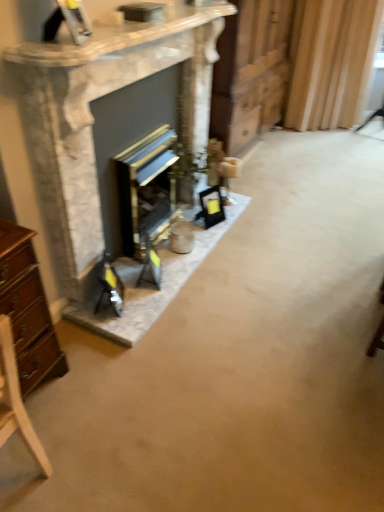
The width and height of the screenshot is (384, 512). Describe the element at coordinates (250, 71) in the screenshot. I see `wooden at center` at that location.

This screenshot has height=512, width=384. Describe the element at coordinates (146, 189) in the screenshot. I see `gold metallic wood burning stove at center` at that location.

Describe the element at coordinates (16, 400) in the screenshot. I see `light wood chair at lower left` at that location.

Identify the location of marble fireplace at center. Image resolution: width=384 pixels, height=512 pixels. (93, 118).

In order to face matte black picture frame at center, should I rotate leftwards or rightwards?

Turn right approximately 2.700 degrees to face it.

I want to click on wooden at center, so click(x=250, y=71).

Consider the image. From a real-world perspective, does wooden at center stand above gold metallic wood burning stove at center?

Indeed, from a real-world perspective, wooden at center stands above gold metallic wood burning stove at center.

Looking at their sizes, would you say wooden at center is wider or thinner than gold metallic wood burning stove at center?

Considering their sizes, wooden at center looks broader than gold metallic wood burning stove at center.

Based on the photo, does wooden at center touch gold metallic wood burning stove at center?

No, wooden at center is not next to gold metallic wood burning stove at center.

Which object is more forward, wooden at center or gold metallic wood burning stove at center?

Positioned in front is gold metallic wood burning stove at center.

From the image's perspective, which is above, marble fireplace at center or matte black picture frame at center?

marble fireplace at center.

Does point (47, 71) appear closer or farther from the camera than point (212, 208)?

Point (47, 71).

Considering the relative sizes of marble fireplace at center and matte black picture frame at center in the image provided, is marble fireplace at center bigger than matte black picture frame at center?

Correct, marble fireplace at center is larger in size than matte black picture frame at center.

Is light wood chair at lower left touching matte black picture frame at center?

No, light wood chair at lower left is not making contact with matte black picture frame at center.

How far apart are light wood chair at lower left and matte black picture frame at center?

light wood chair at lower left is 1.64 meters from matte black picture frame at center.

From a real-world perspective, which is physically above, light wood chair at lower left or matte black picture frame at center?

From a 3D spatial view, light wood chair at lower left is above.

Image resolution: width=384 pixels, height=512 pixels. In order to click on picture frame behind the light wood chair at lower left in this screenshot , I will do `click(211, 206)`.

From a real-world perspective, which object stands above the other?

wooden at center.

Is wooden at center smaller than marble fireplace at center?

Actually, wooden at center might be larger than marble fireplace at center.

Which is more to the right, wooden at center or marble fireplace at center?

wooden at center.

Is marble fireplace at center directly adjacent to light wood chair at lower left?

No, marble fireplace at center is not with light wood chair at lower left.

Considering the positions of objects marble fireplace at center and light wood chair at lower left in the image provided, who is in front, marble fireplace at center or light wood chair at lower left?

light wood chair at lower left is more forward.

Which of these two, marble fireplace at center or light wood chair at lower left, is thinner?

Thinner between the two is marble fireplace at center.

From the image's perspective, is marble fireplace at center located above or below light wood chair at lower left?

Based on their image positions, marble fireplace at center is located above light wood chair at lower left.

Is point (246, 76) closer to camera compared to point (335, 110)?

Yes, it is.

You are a GUI agent. You are given a task and a screenshot of the screen. Output one action in this format:
    pyautogui.click(x=<x>, y=<y>)
    Task: Click on the dresser that appears on the left of wooden curtain at right
    The height and width of the screenshot is (512, 384).
    Given the screenshot: What is the action you would take?
    pyautogui.click(x=250, y=71)

Considering the relative positions of wooden at center and wooden curtain at right in the image provided, is wooden at center to the right of wooden curtain at right from the viewer's perspective?

No, wooden at center is not to the right of wooden curtain at right.

Which is correct: matte black picture frame at center is inside light wood chair at lower left, or outside of it?

The correct answer is: outside.

Considering the sizes of objects matte black picture frame at center and light wood chair at lower left in the image provided, who is taller, matte black picture frame at center or light wood chair at lower left?

light wood chair at lower left is taller.

Considering the relative sizes of matte black picture frame at center and light wood chair at lower left in the image provided, is matte black picture frame at center thinner than light wood chair at lower left?

Yes, matte black picture frame at center is thinner than light wood chair at lower left.

Locate an element on the screen. Image resolution: width=384 pixels, height=512 pixels. picture frame behind the light wood chair at lower left is located at coordinates (211, 206).

Where is `wood burning stove that appears below the wooden at center (from the image's perspective)`? The image size is (384, 512). wood burning stove that appears below the wooden at center (from the image's perspective) is located at coordinates (146, 189).

The height and width of the screenshot is (512, 384). I want to click on fireplace in front of the matte black picture frame at center, so click(x=93, y=118).

Considering their positions, is wooden curtain at right positioned further to matte black picture frame at center than gold metallic wood burning stove at center?

wooden curtain at right lies further to matte black picture frame at center than the other object.

Based on their spatial positions, is wooden at center or gold metallic wood burning stove at center further from marble fireplace at center?

wooden at center lies further to marble fireplace at center than the other object.

When comparing their distances from gold metallic wood burning stove at center, does matte black picture frame at center or wooden at center seem further?

The object further to gold metallic wood burning stove at center is wooden at center.

Looking at the image, which one is located closer to wooden curtain at right, gold metallic wood burning stove at center or light wood chair at lower left?

Among the two, gold metallic wood burning stove at center is located nearer to wooden curtain at right.

From the image, which object appears to be nearer to marble fireplace at center, matte black picture frame at center or gold metallic wood burning stove at center?

Based on the image, gold metallic wood burning stove at center appears to be nearer to marble fireplace at center.

Estimate the real-world distances between objects in this image. Which object is closer to gold metallic wood burning stove at center, light wood chair at lower left or matte black picture frame at center?

matte black picture frame at center is closer to gold metallic wood burning stove at center.

When comparing their distances from gold metallic wood burning stove at center, does wooden at center or wooden curtain at right seem further?

Based on the image, wooden curtain at right appears to be further to gold metallic wood burning stove at center.

Considering their positions, is marble fireplace at center positioned further to gold metallic wood burning stove at center than wooden curtain at right?

wooden curtain at right lies further to gold metallic wood burning stove at center than the other object.

The image size is (384, 512). Find the location of `dresser positioned between marble fireplace at center and wooden curtain at right from near to far`. dresser positioned between marble fireplace at center and wooden curtain at right from near to far is located at coordinates (250, 71).

Locate an element on the screen. The height and width of the screenshot is (512, 384). picture frame between wooden at center and light wood chair at lower left from top to bottom is located at coordinates (211, 206).

The width and height of the screenshot is (384, 512). Identify the location of dresser between wooden curtain at right and matte black picture frame at center in the vertical direction. (250, 71).

The image size is (384, 512). Identify the location of dresser between light wood chair at lower left and wooden curtain at right along the z-axis. (250, 71).